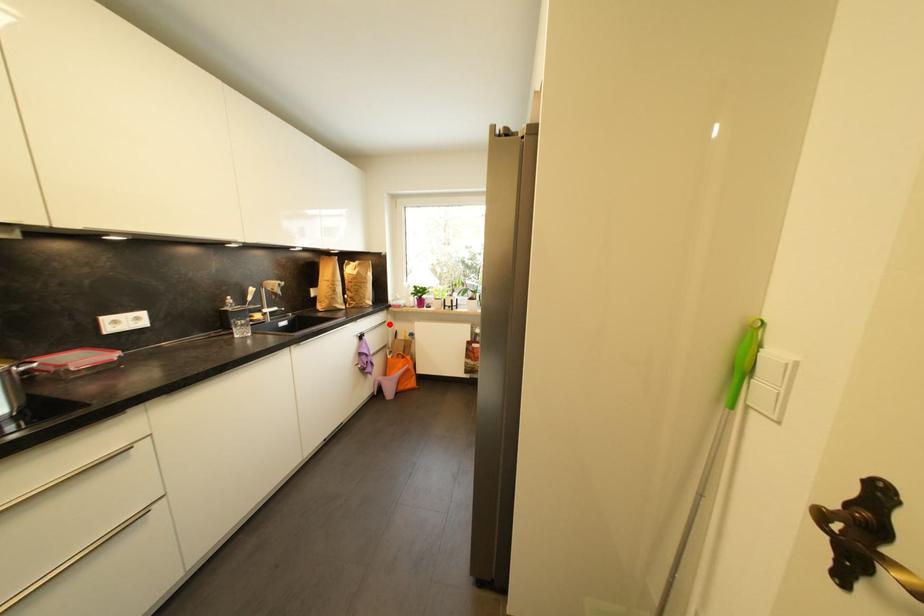
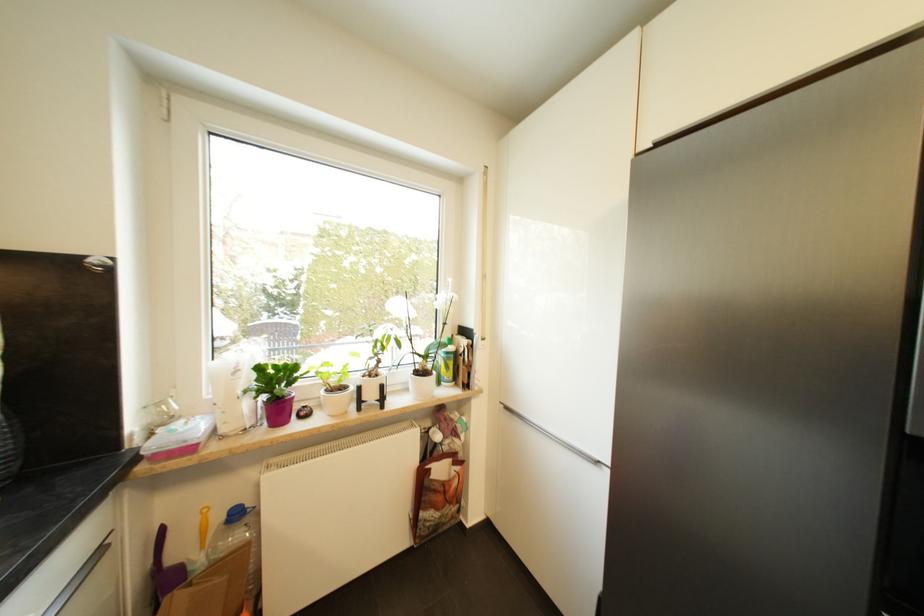
Question: I am providing you with two images of the same scene from different viewpoints. Image1 has a red point marked. In image2, the corresponding 3D location appears at what relative position? Reply with the corresponding letter.

Choices:
 (A) Closer
 (B) Farther

Answer: (B)